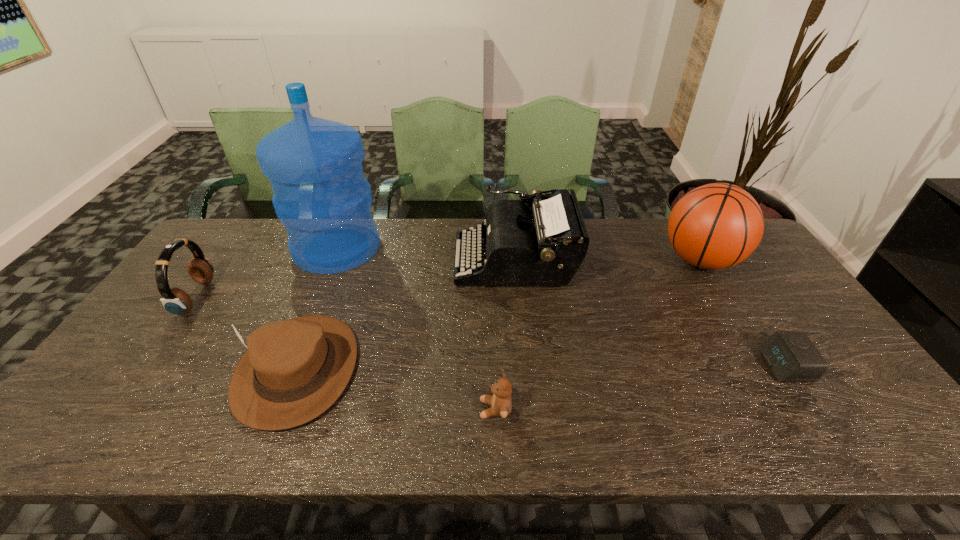
In order to click on vacant space at the far left corner of the desktop in this screenshot , I will do `click(244, 256)`.

Where is `vacant space at the near left corner of the desktop`? The height and width of the screenshot is (540, 960). vacant space at the near left corner of the desktop is located at coordinates click(70, 438).

The height and width of the screenshot is (540, 960). In order to click on vacant space at the near right corner of the desktop in this screenshot , I will do `click(828, 418)`.

Find the location of a particular element. The height and width of the screenshot is (540, 960). empty space that is in between the alarm clock and the second tallest object is located at coordinates [x=742, y=313].

Identify the location of unoccupied position between the headset and the fedora. (247, 333).

Locate an element on the screen. This screenshot has width=960, height=540. vacant area that lies between the typewriter and the shortest object is located at coordinates (650, 313).

The image size is (960, 540). In order to click on vacant region between the leftmost object and the fedora in this screenshot , I will do `click(247, 333)`.

Where is `unoccupied area between the tallest object and the shortest object`? The width and height of the screenshot is (960, 540). unoccupied area between the tallest object and the shortest object is located at coordinates (561, 307).

Locate an element on the screen. This screenshot has width=960, height=540. free space between the typewriter and the tallest object is located at coordinates (426, 254).

The image size is (960, 540). Find the location of `free space between the leftmost object and the sixth shortest object`. free space between the leftmost object and the sixth shortest object is located at coordinates [x=448, y=279].